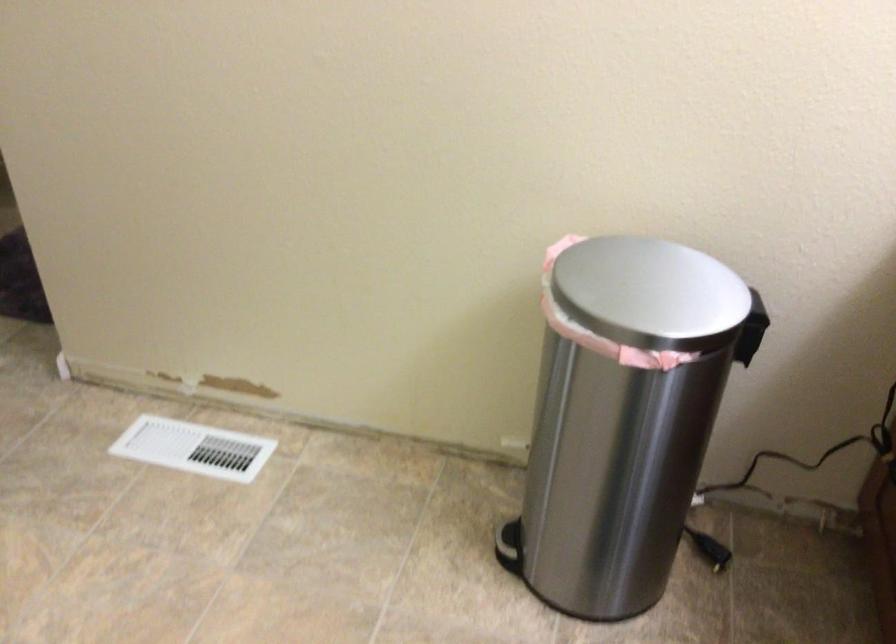
Locate an element on the screen. silver trash can lid is located at coordinates (658, 288).